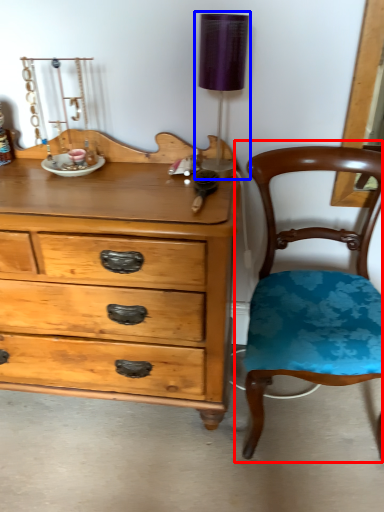
Question: Which object is further to the camera taking this photo, chair (highlighted by a red box) or table lamp (highlighted by a blue box)?

Choices:
 (A) chair
 (B) table lamp

Answer: (B)